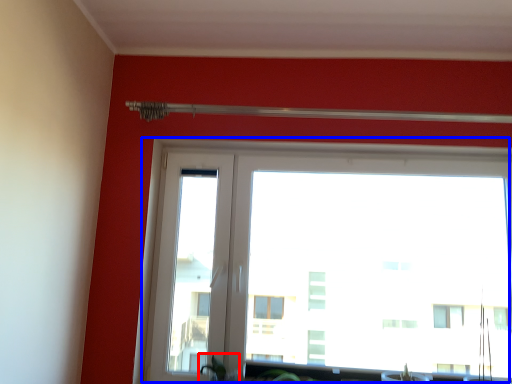
Question: Among these objects, which one is farthest to the camera, plant (highlighted by a red box) or window (highlighted by a blue box)?

Choices:
 (A) plant
 (B) window

Answer: (B)